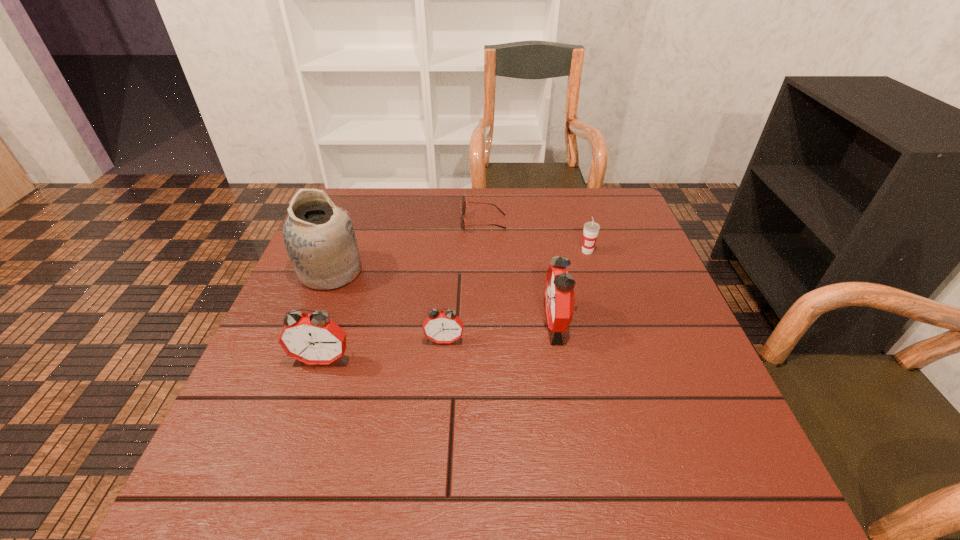
Find the location of a particular element. alarm clock that is the closest to the tallest object is located at coordinates coord(314,338).

Locate an element on the screen. Image resolution: width=960 pixels, height=540 pixels. vacant region that satisfies the following two spatial constraints: 1. on the side of the rightmost object with the logo; 2. on the clock face of the rightmost alarm clock is located at coordinates (609, 323).

The height and width of the screenshot is (540, 960). I want to click on free space that satisfies the following two spatial constraints: 1. on the clock face of the second object from right to left; 2. on the clock face of the nearest alarm clock, so click(x=564, y=360).

The width and height of the screenshot is (960, 540). Identify the location of free space in the image that satisfies the following two spatial constraints: 1. on the clock face of the second object from right to left; 2. on the clock face of the shortest alarm clock. (561, 341).

Find the location of `vacant position in the image that satisfies the following two spatial constraints: 1. on the clock face of the fifth object from left to right; 2. on the clock face of the shortest alarm clock`. vacant position in the image that satisfies the following two spatial constraints: 1. on the clock face of the fifth object from left to right; 2. on the clock face of the shortest alarm clock is located at coordinates (561, 341).

At what (x,y) coordinates should I click in order to perform the action: click on vacant point that satisfies the following two spatial constraints: 1. on the clock face of the second object from right to left; 2. on the clock face of the nearest object. Please return your answer as a coordinate pair (x, y). This screenshot has width=960, height=540. Looking at the image, I should click on (564, 360).

Locate an element on the screen. The height and width of the screenshot is (540, 960). vacant area that satisfies the following two spatial constraints: 1. on the front-facing side of the farthest object; 2. on the clock face of the second alarm clock from left to right is located at coordinates (485, 341).

Locate an element on the screen. The image size is (960, 540). free space that satisfies the following two spatial constraints: 1. on the clock face of the second object from right to left; 2. on the clock face of the second alarm clock from right to left is located at coordinates (561, 341).